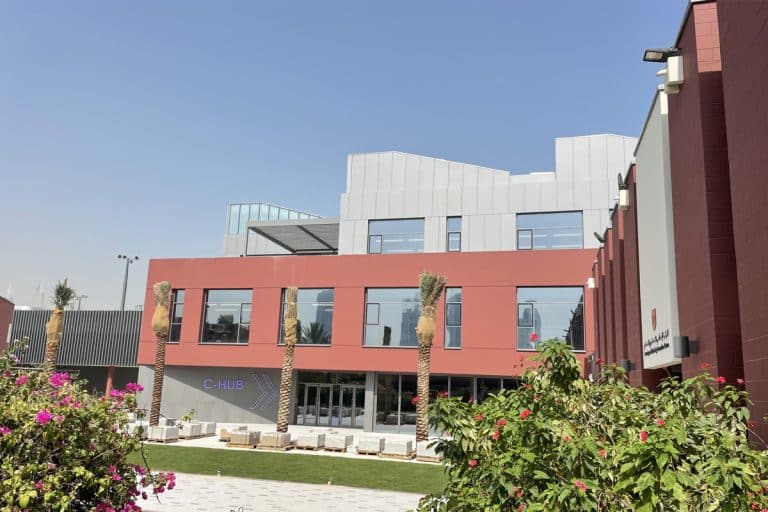
Find the location of `glass doors`. glass doors is located at coordinates (346, 399), (326, 400).